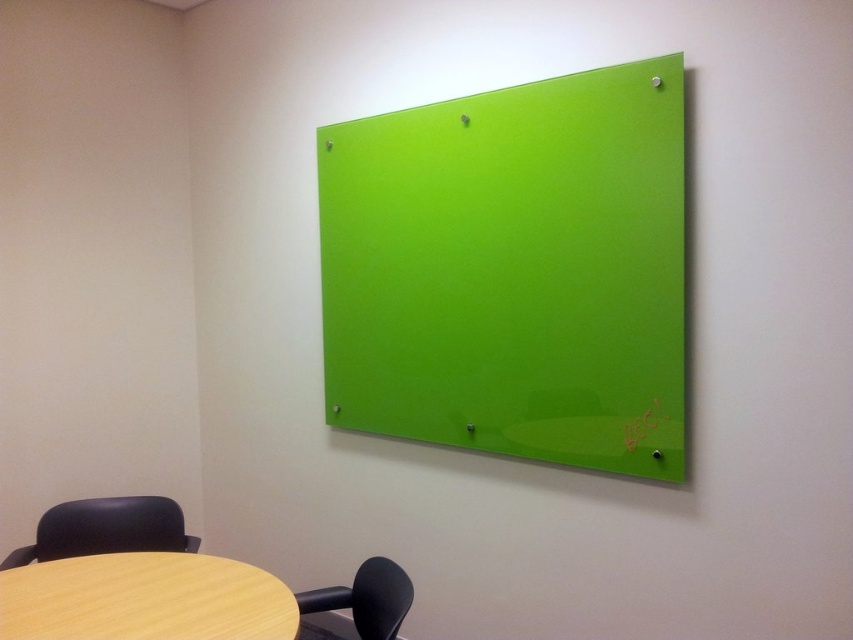
Question: Which point is closer to the camera taking this photo?

Choices:
 (A) (303, 604)
 (B) (154, 547)
 (C) (148, 593)

Answer: (C)

Question: Can you confirm if wooden table at lower left is wider than black leather swivel chair at lower left?

Choices:
 (A) yes
 (B) no

Answer: (A)

Question: Does wooden table at lower left lie behind black leather swivel chair at lower left?

Choices:
 (A) yes
 (B) no

Answer: (B)

Question: Which point is closer to the camera?

Choices:
 (A) black leather swivel chair at lower left
 (B) wooden table at lower left
 (C) matte black chair at lower left

Answer: (B)

Question: Does wooden table at lower left have a lesser width compared to black leather swivel chair at lower left?

Choices:
 (A) yes
 (B) no

Answer: (B)

Question: Which point appears farthest from the camera in this image?

Choices:
 (A) (370, 588)
 (B) (106, 531)

Answer: (B)